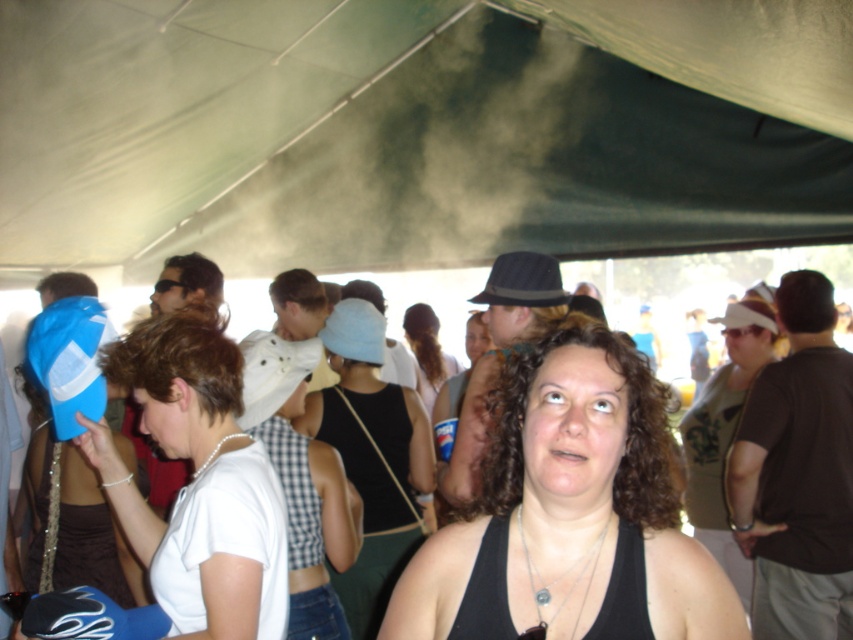
You are at the event and want to take a photo of the black tank top at center and the black fabric tank top at center. Which one will appear larger in your photo?

The black tank top at center will appear larger in the photo because it is closer to the viewer than the black fabric tank top at center.

You are at the point marked as point (x=173, y=608) and want to walk towards the exit located at point (x=433, y=381). Since you can only move in straight lines, will you have to go around any obstacles between these two points?

Point (x=173, y=608) is in front of point (x=433, y=381), so you can walk straight towards the exit without needing to go around any obstacles between them.